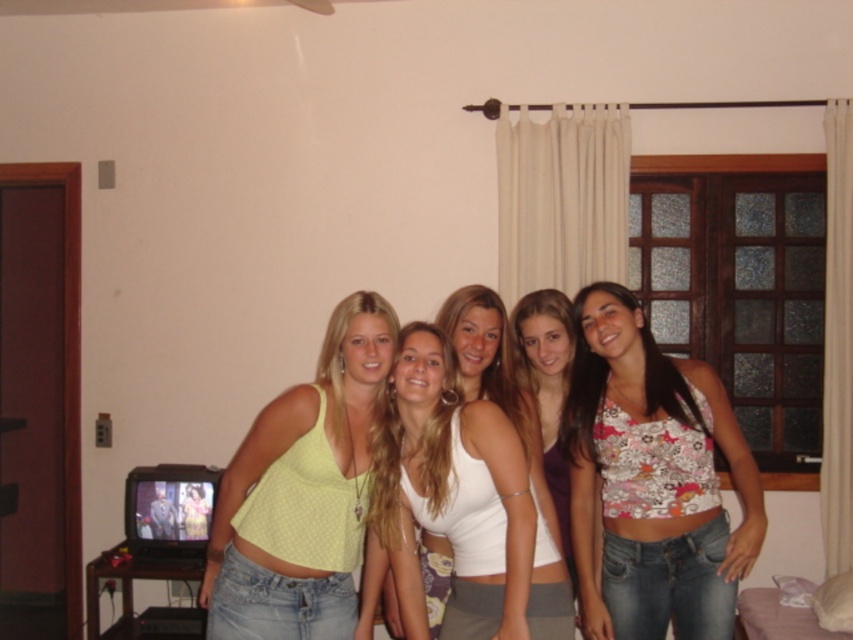
Question: Does white matte tank top at center have a greater width compared to floral fabric top at center?

Choices:
 (A) no
 (B) yes

Answer: (B)

Question: Which is nearer to the white matte tank top at center?

Choices:
 (A) floral-patterned fabric top at center
 (B) light yellow fabric top at center
 (C) floral fabric top at center

Answer: (B)

Question: Which object is closer to the camera taking this photo?

Choices:
 (A) light yellow fabric top at center
 (B) floral-patterned fabric top at center
 (C) white matte tank top at center

Answer: (C)

Question: Is the position of light yellow fabric top at center more distant than that of floral fabric top at center?

Choices:
 (A) no
 (B) yes

Answer: (A)

Question: Can you confirm if white matte tank top at center is bigger than floral fabric top at center?

Choices:
 (A) yes
 (B) no

Answer: (A)

Question: Which point is farther from the camera taking this photo?

Choices:
 (A) (369, 317)
 (B) (479, 612)
 (C) (558, 483)

Answer: (C)